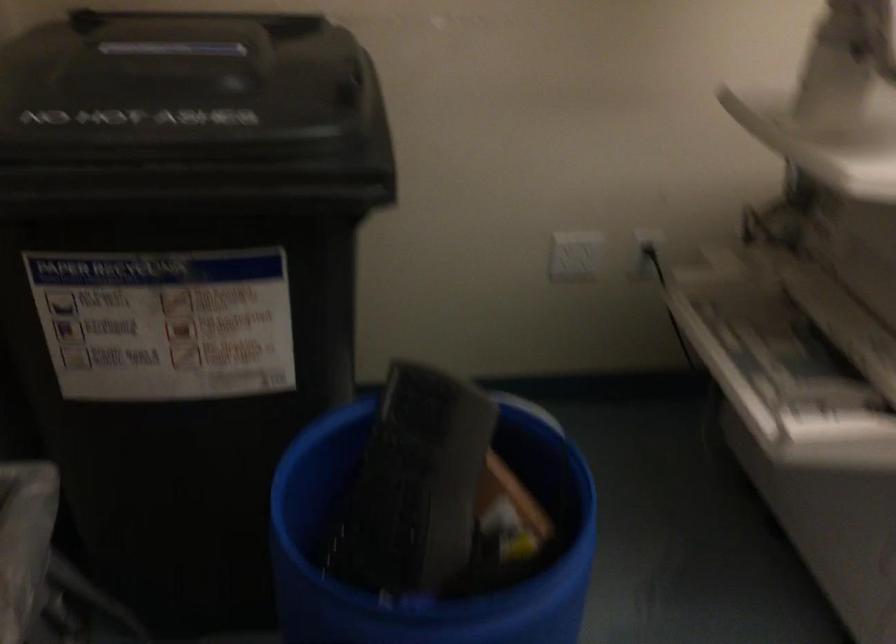
What do you see at coordinates (648, 251) in the screenshot? The width and height of the screenshot is (896, 644). I see `a black power plug` at bounding box center [648, 251].